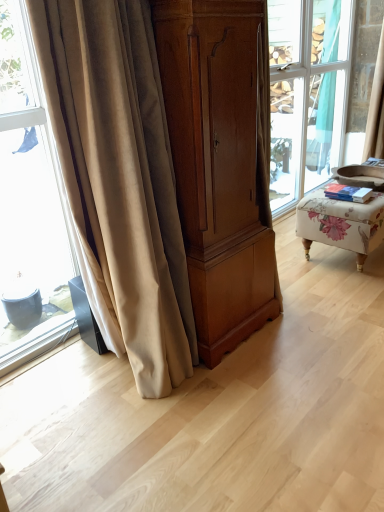
This screenshot has width=384, height=512. Identify the location of spots to the right of beige velvet curtain at left, the 2th curtain positioned from the back. (248, 382).